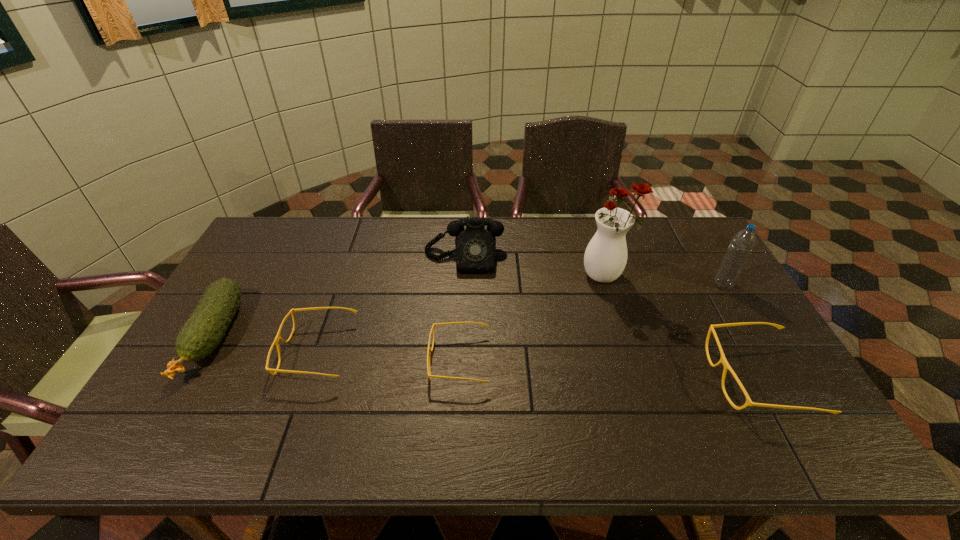
To ensure equal spacing by inserting another spectacles among them, please point out a vacant spot for this new spectacles. Please provide its 2D coordinates. Your answer should be formatted as a tuple, i.e. [(x, y)], where the tuple contains the x and y coordinates of a point satisfying the conditions above.

[(606, 369)]